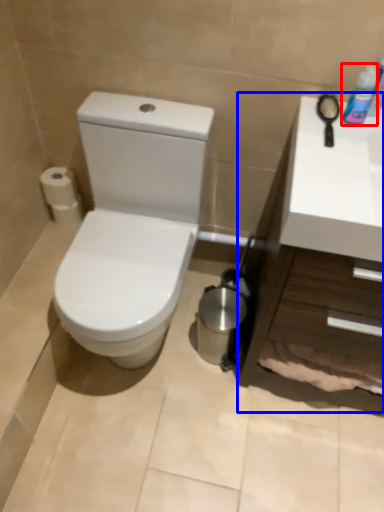
Question: Which object is further to the camera taking this photo, mouthwash (highlighted by a red box) or counter top (highlighted by a blue box)?

Choices:
 (A) mouthwash
 (B) counter top

Answer: (A)